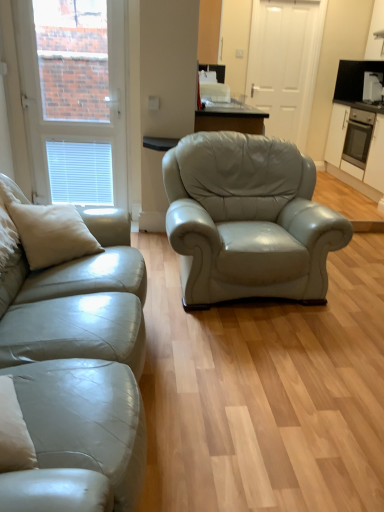
Question: Can you confirm if white glossy toaster at upper right is positioned to the left of white matte window at upper left?

Choices:
 (A) yes
 (B) no

Answer: (B)

Question: Is white glossy toaster at upper right surrounding white matte window at upper left?

Choices:
 (A) yes
 (B) no

Answer: (B)

Question: Considering the relative sizes of white glossy toaster at upper right and white matte window at upper left in the image provided, is white glossy toaster at upper right wider than white matte window at upper left?

Choices:
 (A) no
 (B) yes

Answer: (A)

Question: Is white glossy toaster at upper right looking in the opposite direction of white matte window at upper left?

Choices:
 (A) no
 (B) yes

Answer: (A)

Question: Does white glossy toaster at upper right appear on the right side of white matte window at upper left?

Choices:
 (A) no
 (B) yes

Answer: (B)

Question: From a real-world perspective, is satin beige leather couch at left physically located above or below beige leather pillow at left?

Choices:
 (A) below
 (B) above

Answer: (A)

Question: Looking at the image, does satin beige leather couch at left seem bigger or smaller compared to beige leather pillow at left?

Choices:
 (A) big
 (B) small

Answer: (A)

Question: Is satin beige leather couch at left taller or shorter than beige leather pillow at left?

Choices:
 (A) short
 (B) tall

Answer: (B)

Question: Is satin beige leather couch at left in front of or behind beige leather pillow at left in the image?

Choices:
 (A) front
 (B) behind

Answer: (A)

Question: Considering the positions of white matte cabinet at right and white matte door at center in the image, is white matte cabinet at right taller or shorter than white matte door at center?

Choices:
 (A) short
 (B) tall

Answer: (A)

Question: Does point (350, 164) appear closer or farther from the camera than point (281, 69)?

Choices:
 (A) closer
 (B) farther

Answer: (A)

Question: From the image's perspective, is white matte cabinet at right above or below white matte door at center?

Choices:
 (A) above
 (B) below

Answer: (B)

Question: Is white matte cabinet at right wider or thinner than white matte door at center?

Choices:
 (A) wide
 (B) thin

Answer: (A)

Question: From a real-world perspective, is beige leather pillow at left positioned above or below white matte window at upper left?

Choices:
 (A) above
 (B) below

Answer: (B)

Question: From the image's perspective, relative to white matte window at upper left, is beige leather pillow at left above or below?

Choices:
 (A) above
 (B) below

Answer: (B)